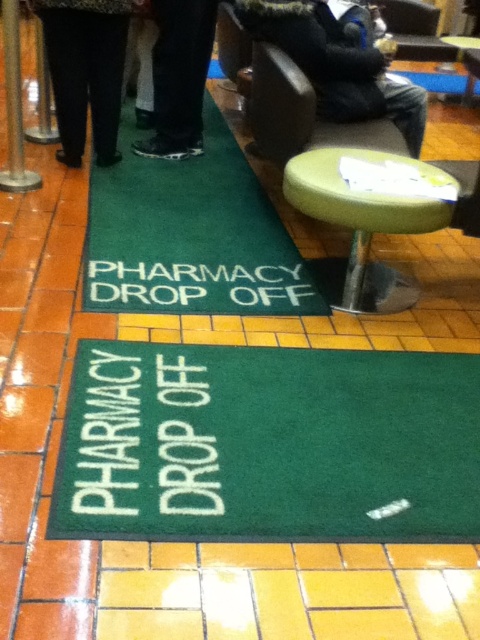
Question: Considering the real-world distances, which object is closest to the black leather shoes at center?

Choices:
 (A) green rubber mat at center
 (B) dark blue jeans at center
 (C) green fabric stool at center
 (D) green carpet at center

Answer: (B)

Question: Is green fabric stool at center closer to camera compared to dark brown leather jacket at upper center?

Choices:
 (A) yes
 (B) no

Answer: (A)

Question: Which object is the closest to the green rubber mat at center?

Choices:
 (A) green carpet at center
 (B) green fabric stool at center
 (C) dark brown leather jacket at upper center
 (D) black leather shoes at center

Answer: (B)

Question: Considering the real-world distances, which object is closest to the green rubber mat at center?

Choices:
 (A) black leather shoes at center
 (B) green carpet at center
 (C) dark blue jeans at center

Answer: (B)

Question: Is green fabric stool at center smaller than dark blue jeans at center?

Choices:
 (A) yes
 (B) no

Answer: (B)

Question: Where is green carpet at center located in relation to dark brown leather jacket at upper center in the image?

Choices:
 (A) left
 (B) right

Answer: (A)